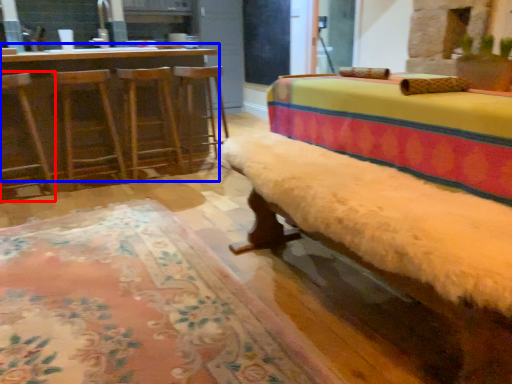
Question: Which point is closer to the camera, swivel chair (highlighted by a red box) or table (highlighted by a blue box)?

Choices:
 (A) swivel chair
 (B) table

Answer: (A)